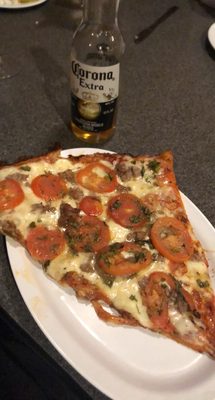
I want to click on table top, so click(x=169, y=97).